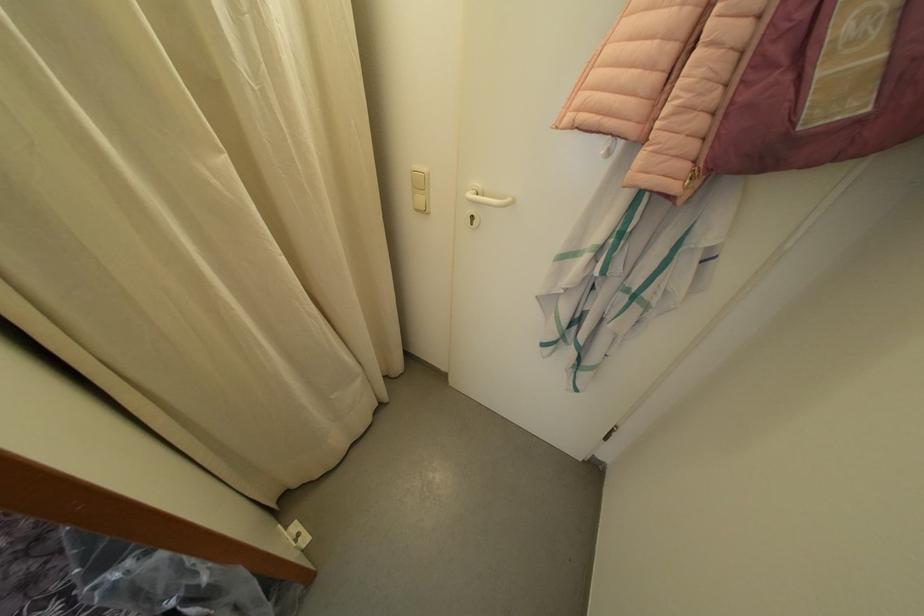
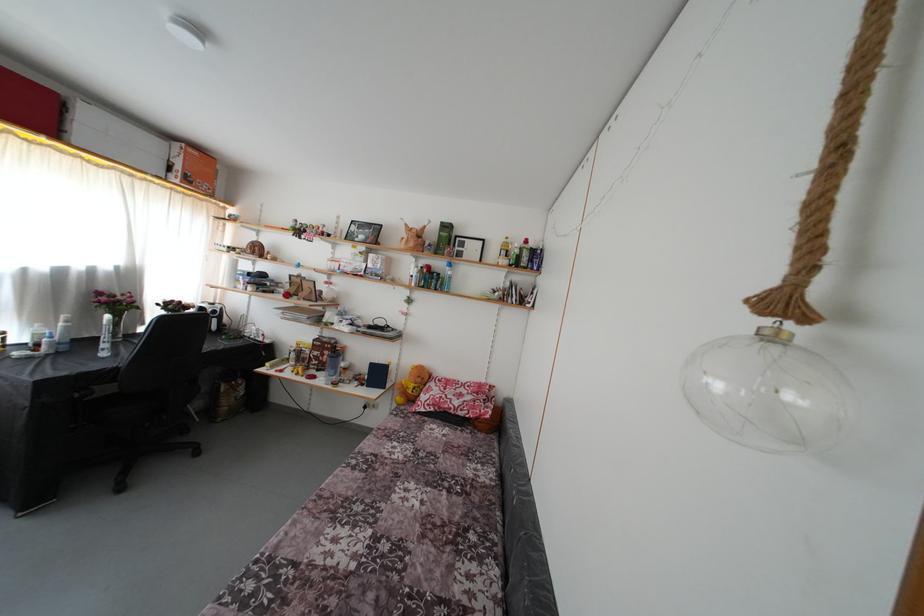
How did the camera likely rotate?

The camera rotated toward left-up.